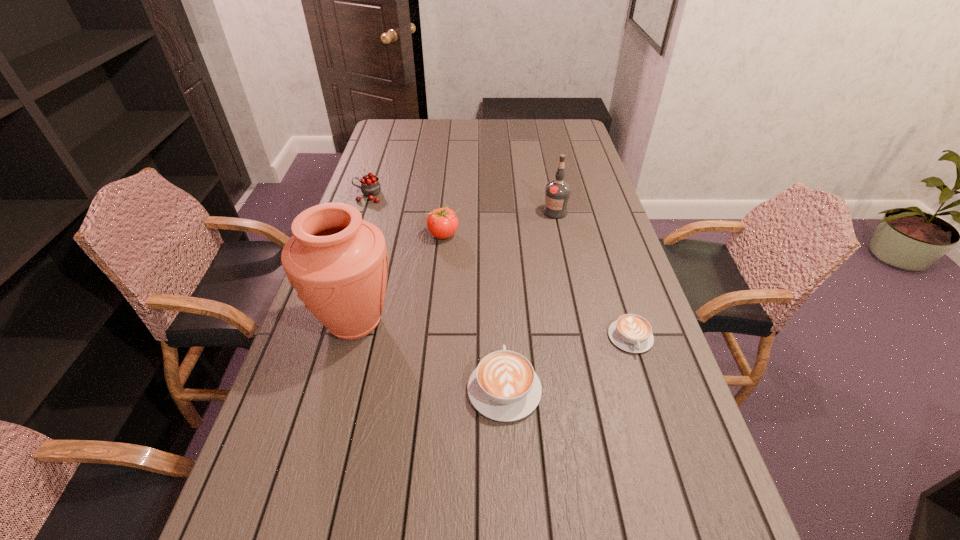
Identify the location of free location located 0.310m on the side of the nearer cappuccino with the handle. (499, 273).

Where is `free space located on the side of the nearer cappuccino with the handle`? free space located on the side of the nearer cappuccino with the handle is located at coordinates (498, 268).

This screenshot has width=960, height=540. What are the coordinates of `blank space located on the side of the nearer cappuccino with the handle` in the screenshot? It's located at tap(499, 271).

Where is `vacant space positioned on the side of the farther cappuccino with the handle`? The height and width of the screenshot is (540, 960). vacant space positioned on the side of the farther cappuccino with the handle is located at coordinates (671, 464).

Where is `free space located 0.180m on the front label of the second object from right to left`? This screenshot has height=540, width=960. free space located 0.180m on the front label of the second object from right to left is located at coordinates (564, 253).

Where is `free region located 0.060m on the right of the vase`? free region located 0.060m on the right of the vase is located at coordinates (420, 322).

I want to click on blank area located 0.120m on the front of the fourth object from right to left, so click(440, 269).

The width and height of the screenshot is (960, 540). Identify the location of cherry at the left edge. (370, 186).

Locate an element on the screen. This screenshot has height=540, width=960. vase situated at the left edge is located at coordinates tap(338, 263).

The width and height of the screenshot is (960, 540). I want to click on cappuccino situated at the right edge, so click(x=632, y=333).